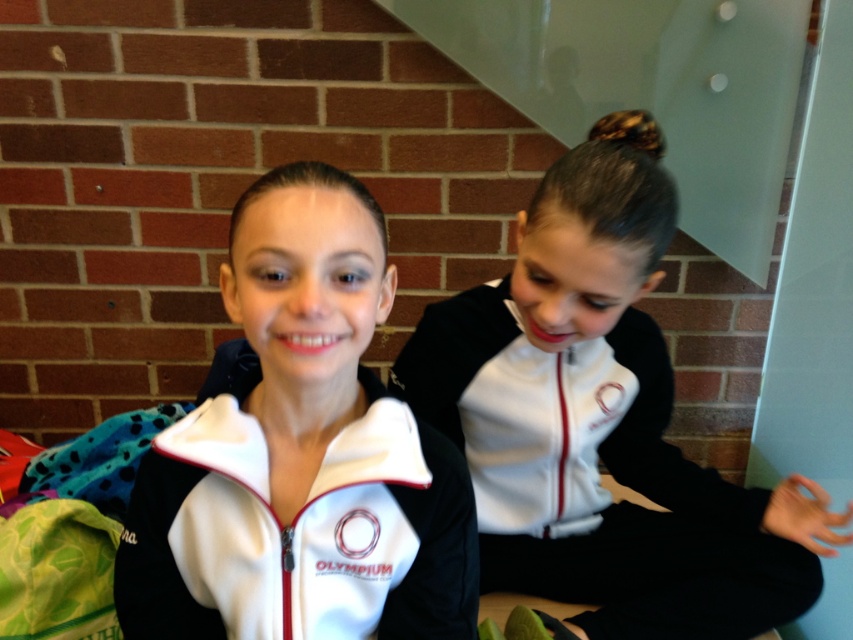
You are a photographer setting up for a group photo. You need to arrange the two people so that their jackets are visible and not overlapping. Given that the white matte jacket at center and the white matte jacket at right have different lengths, which jacket should be placed in the back to ensure the shorter jacket is fully visible?

The white matte jacket at center is shorter than the white matte jacket at right. To ensure the shorter jacket is fully visible, the white matte jacket at right should be placed in the back, allowing the shorter jacket at center to be in front without being obscured by the longer one.